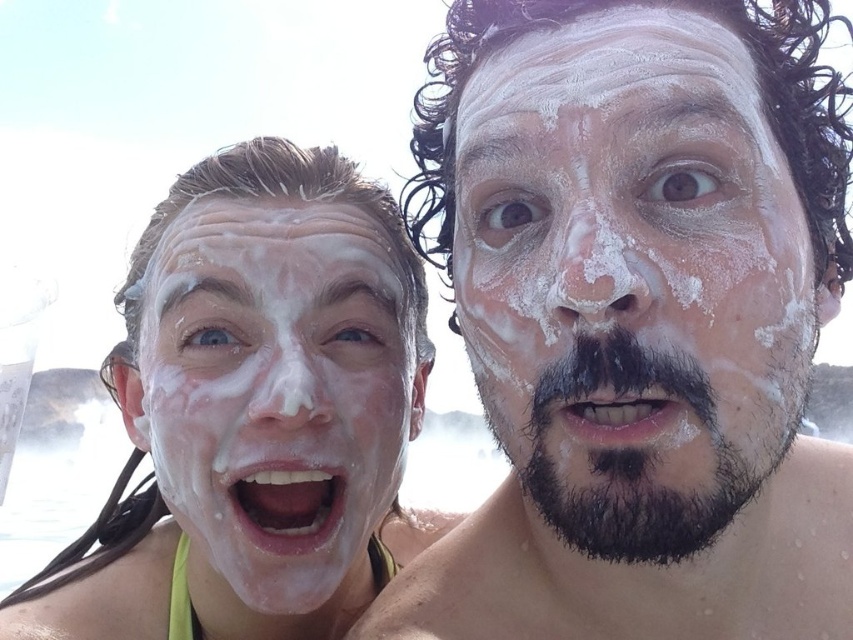
Is point (71, 579) positioned in front of point (624, 484)?

No, (71, 579) is behind (624, 484).

Locate an element on the screen. The height and width of the screenshot is (640, 853). white matte foam at left is located at coordinates (254, 413).

Locate an element on the screen. white matte foam at left is located at coordinates (254, 413).

Can you confirm if white matte foam at left is smaller than white foamy face at left?

No, white matte foam at left is not smaller than white foamy face at left.

Locate an element on the screen. white matte foam at left is located at coordinates [x=254, y=413].

Is white foamy face at left below dark brown thick hair at right?

Actually, white foamy face at left is above dark brown thick hair at right.

What do you see at coordinates (276, 388) in the screenshot? The height and width of the screenshot is (640, 853). I see `white foamy face at left` at bounding box center [276, 388].

Identify the location of white foamy face at left. Image resolution: width=853 pixels, height=640 pixels. (276, 388).

Image resolution: width=853 pixels, height=640 pixels. In order to click on white foamy face at left in this screenshot , I will do `click(276, 388)`.